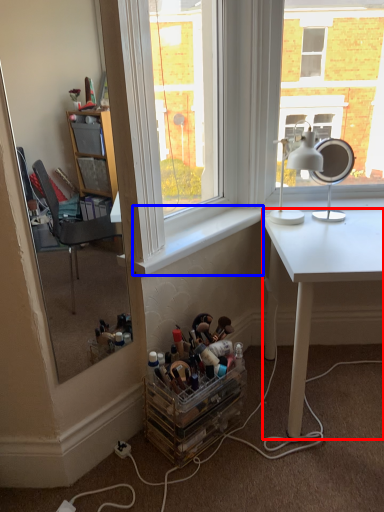
Question: Which object appears farthest to the camera in this image, desk (highlighted by a red box) or window sill (highlighted by a blue box)?

Choices:
 (A) desk
 (B) window sill

Answer: (B)